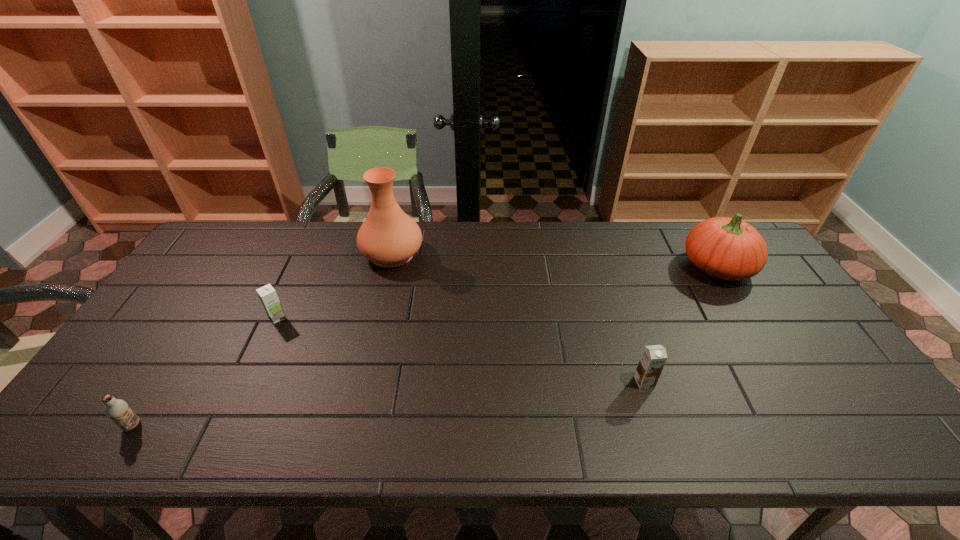
The width and height of the screenshot is (960, 540). In order to click on free location located 0.190m on the front of the tallest object in this screenshot , I will do `click(376, 319)`.

In order to click on blank space located 0.120m on the left of the pumpkin in this screenshot , I will do coord(644,267).

Where is `vacant space located on the left of the second nearest object`? vacant space located on the left of the second nearest object is located at coordinates (554, 382).

The width and height of the screenshot is (960, 540). What are the coordinates of `vacant space located on the left of the second chocolate milk from left to right` in the screenshot? It's located at (240, 318).

Locate an element on the screen. The image size is (960, 540). vacant area situated on the back of the leftmost chocolate milk is located at coordinates (171, 364).

You are a GUI agent. You are given a task and a screenshot of the screen. Output one action in this format:
    pyautogui.click(x=<x>, y=<y>)
    Task: Click on the vase located at the far edge
    The height and width of the screenshot is (540, 960).
    Given the screenshot: What is the action you would take?
    pyautogui.click(x=388, y=237)

You are a GUI agent. You are given a task and a screenshot of the screen. Output one action in this format:
    pyautogui.click(x=<x>, y=<y>)
    Task: Click on the pumpkin that is at the far edge
    
    Given the screenshot: What is the action you would take?
    pyautogui.click(x=727, y=248)

The width and height of the screenshot is (960, 540). Identify the location of object situated at the near edge. (117, 410).

You are a GUI agent. You are given a task and a screenshot of the screen. Output one action in this format:
    pyautogui.click(x=<x>, y=<y>)
    Task: Click on the object at the left edge
    This screenshot has height=540, width=960.
    Given the screenshot: What is the action you would take?
    pyautogui.click(x=117, y=410)

Locate an element on the screen. This screenshot has height=540, width=960. object located in the right edge section of the desktop is located at coordinates (727, 248).